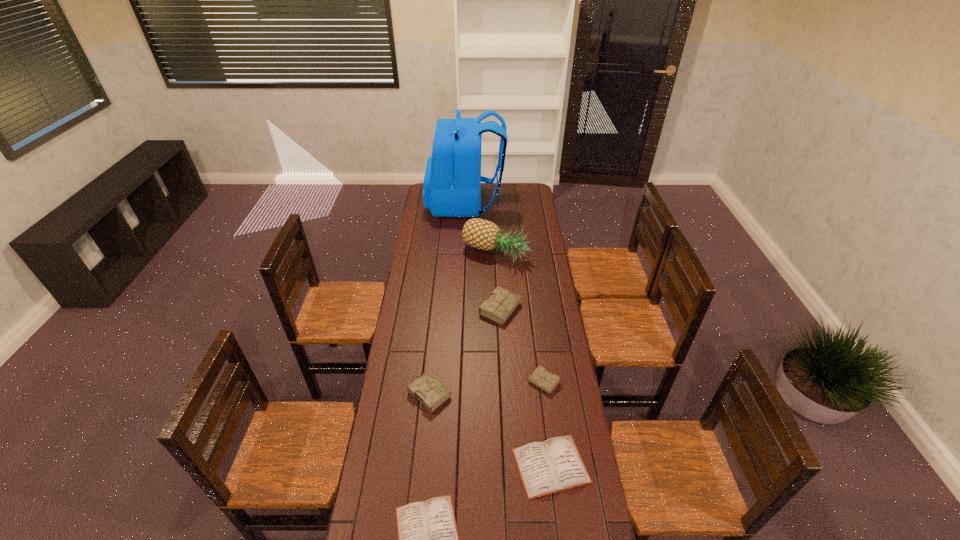
I want to click on blue backpack, so click(x=452, y=183).

This screenshot has width=960, height=540. I want to click on the tallest object, so click(x=452, y=183).

Identify the location of the second tallest object. This screenshot has width=960, height=540. (481, 234).

I want to click on the second farthest object, so click(x=481, y=234).

Find the location of a particular element. The height and width of the screenshot is (540, 960). the fifth nearest object is located at coordinates tap(501, 304).

Locate an element on the screen. Image resolution: width=960 pixels, height=540 pixels. the biggest green diary is located at coordinates (501, 304).

This screenshot has width=960, height=540. I want to click on the second biggest green diary, so click(427, 389).

Image resolution: width=960 pixels, height=540 pixels. Find the location of `the second tallest diary`. the second tallest diary is located at coordinates (427, 389).

Where is `the fifth tallest object`? This screenshot has height=540, width=960. the fifth tallest object is located at coordinates pos(541,378).

The image size is (960, 540). What are the coordinates of `the smallest green diary` in the screenshot? It's located at (541, 378).